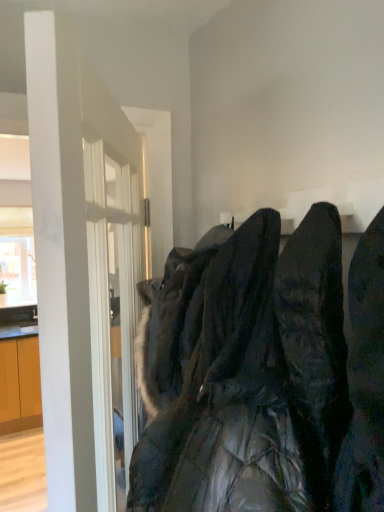
Question: In terms of width, does white glossy door at left look wider or thinner when compared to black quilted jacket at center?

Choices:
 (A) thin
 (B) wide

Answer: (A)

Question: Is point (112, 159) closer or farther from the camera than point (326, 274)?

Choices:
 (A) farther
 (B) closer

Answer: (A)

Question: From a real-world perspective, relative to black quilted jacket at center, is white glossy door at left vertically above or below?

Choices:
 (A) above
 (B) below

Answer: (B)

Question: From the image's perspective, is black quilted jacket at center positioned above or below white glossy door at left?

Choices:
 (A) below
 (B) above

Answer: (B)

Question: Choose the correct answer: Is black quilted jacket at center inside white glossy door at left or outside it?

Choices:
 (A) inside
 (B) outside

Answer: (B)

Question: Based on their sizes in the image, would you say black quilted jacket at center is bigger or smaller than white glossy door at left?

Choices:
 (A) big
 (B) small

Answer: (B)

Question: In terms of width, does black quilted jacket at center look wider or thinner when compared to white glossy door at left?

Choices:
 (A) wide
 (B) thin

Answer: (A)